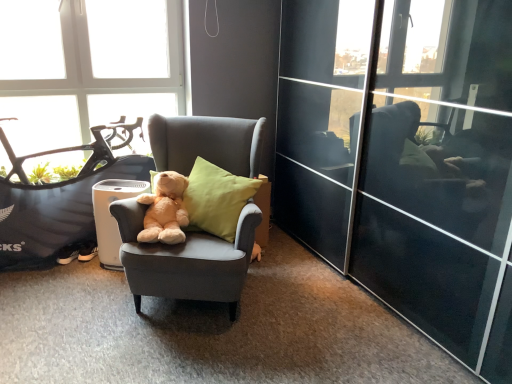
I want to click on vacant space situated on the left part of matte gray armchair at center, so click(65, 303).